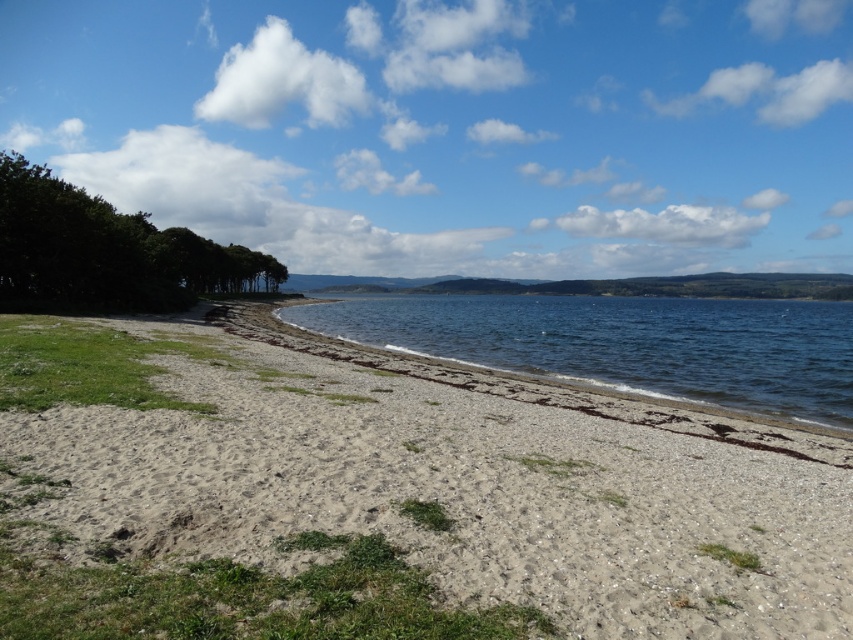
Looking at this image, can you confirm if clear water at center is positioned above green leafy trees at left?

No, clear water at center is not above green leafy trees at left.

Is clear water at center shorter than green leafy trees at left?

Yes.

Which is in front, point (689, 346) or point (16, 276)?

Point (16, 276) is in front.

Identify the location of clear water at center. The image size is (853, 640). (625, 342).

Can you confirm if gray gravelly sand at center is positioned to the left of clear water at center?

Indeed, gray gravelly sand at center is positioned on the left side of clear water at center.

Where is `gray gravelly sand at center`? The image size is (853, 640). gray gravelly sand at center is located at coordinates (389, 497).

Who is more distant from viewer, (308, 442) or (525, 346)?

Positioned behind is point (525, 346).

Identify the location of gray gravelly sand at center. (389, 497).

Can you confirm if gray gravelly sand at center is bigger than green leafy trees at left?

Actually, gray gravelly sand at center might be smaller than green leafy trees at left.

Between gray gravelly sand at center and green leafy trees at left, which one appears on the right side from the viewer's perspective?

Positioned to the right is gray gravelly sand at center.

The height and width of the screenshot is (640, 853). What do you see at coordinates (389, 497) in the screenshot?
I see `gray gravelly sand at center` at bounding box center [389, 497].

The width and height of the screenshot is (853, 640). I want to click on gray gravelly sand at center, so click(x=389, y=497).